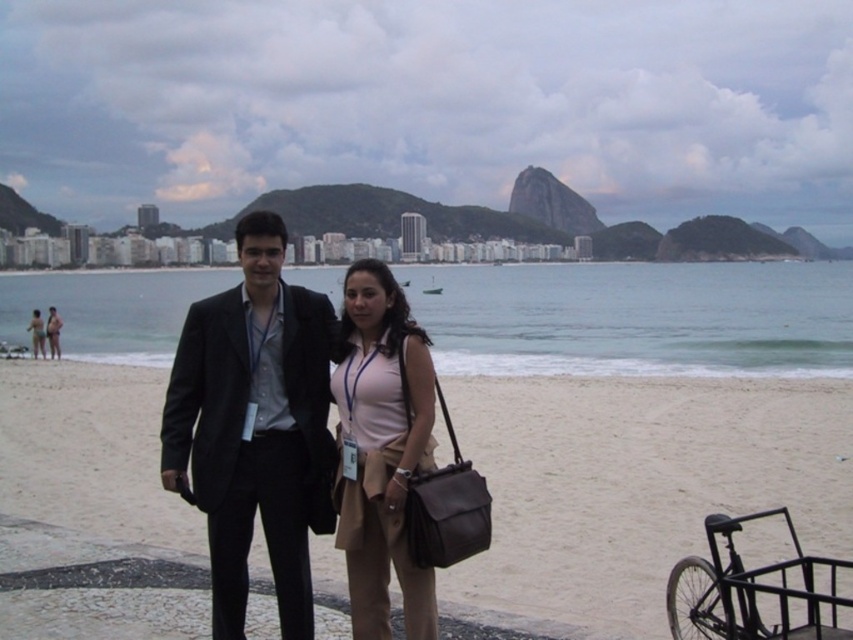
Measure the distance between beige sand at center and black matte suit at center.

beige sand at center is 11.48 meters from black matte suit at center.

Between beige sand at center and black matte suit at center, which one appears on the right side from the viewer's perspective?

beige sand at center is more to the right.

Is point (654, 532) closer to viewer compared to point (297, 580)?

No, (654, 532) is behind (297, 580).

Identify the location of beige sand at center. (637, 484).

Is point (821, 433) more distant than point (32, 340)?

No, it is in front of (32, 340).

Between beige sand at center and matte black suit at center, which one has more height?

matte black suit at center

Image resolution: width=853 pixels, height=640 pixels. I want to click on beige sand at center, so click(x=637, y=484).

You are a GUI agent. You are given a task and a screenshot of the screen. Output one action in this format:
    pyautogui.click(x=<x>, y=<y>)
    Task: Click on the beige sand at center
    
    Given the screenshot: What is the action you would take?
    pyautogui.click(x=637, y=484)

Who is positioned more to the right, black matte suit at center or matte black suit at center?

Positioned to the right is black matte suit at center.

The image size is (853, 640). I want to click on black matte suit at center, so click(x=254, y=428).